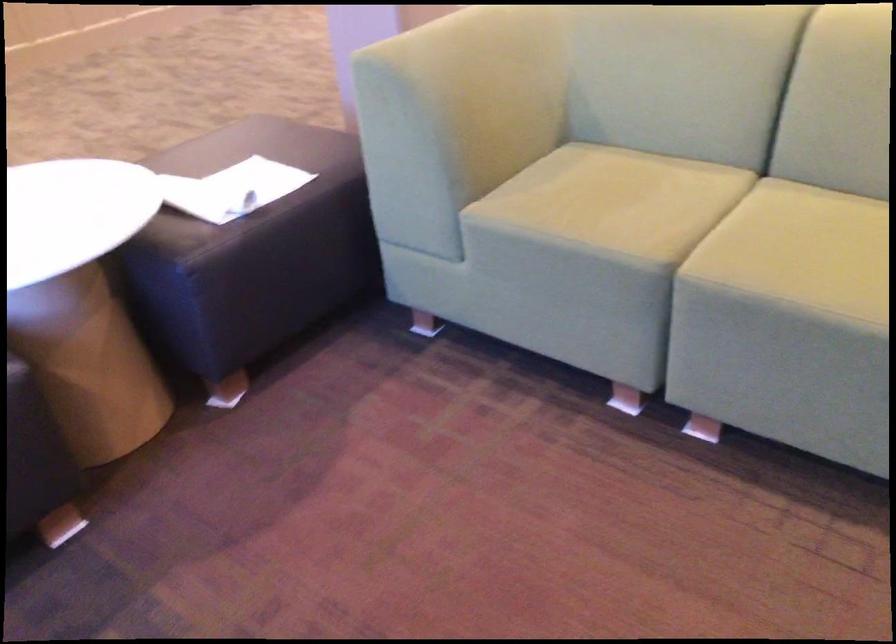
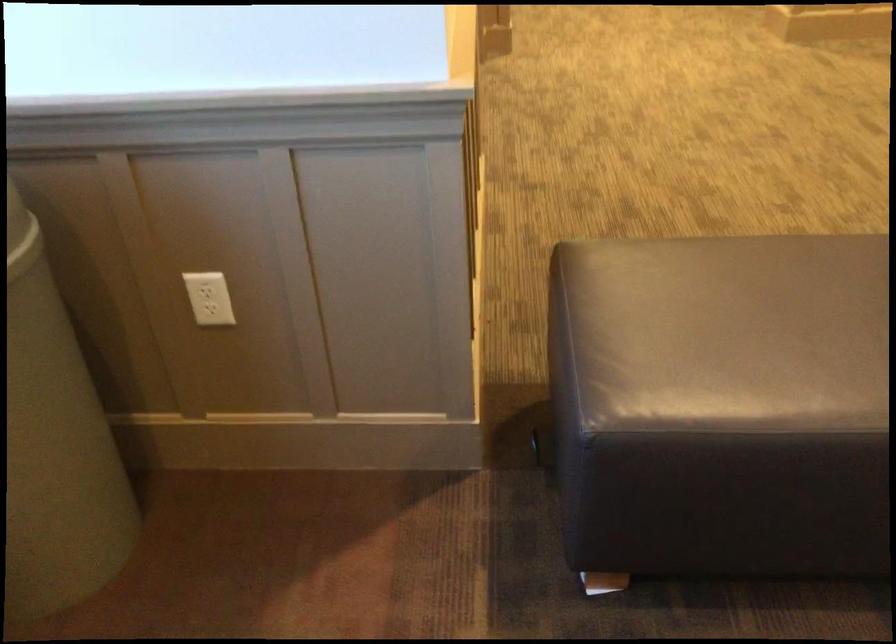
The first image is from the beginning of the video and the second image is from the end. How did the camera likely rotate when shooting the video?

The camera's rotation is toward left-down.